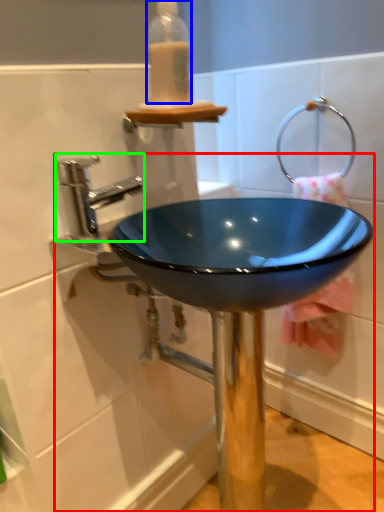
Question: Which object is positioned closest to sink (highlighted by a red box)? Select from bottle (highlighted by a blue box) and tap (highlighted by a green box).

Choices:
 (A) bottle
 (B) tap

Answer: (B)